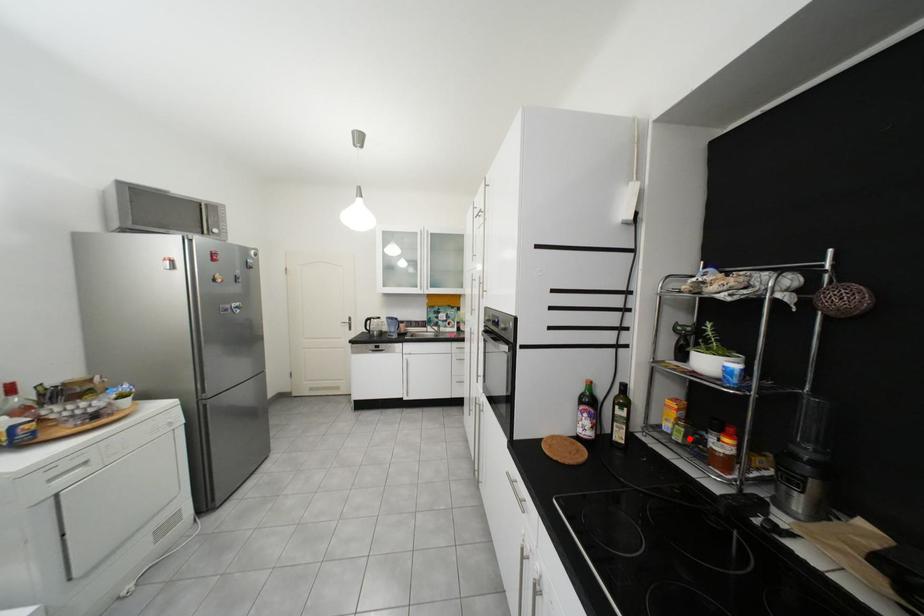
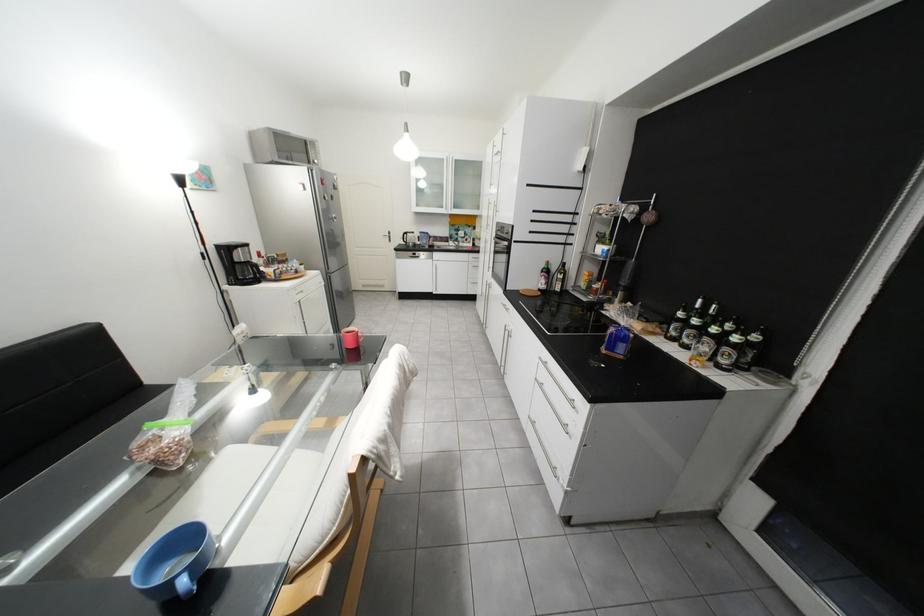
Find the pixel in the second image that matches the highlighted location in the first image.

(596, 288)